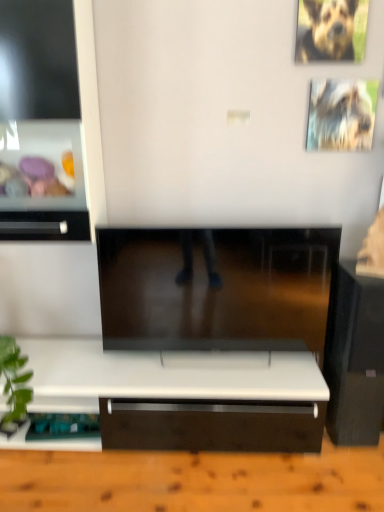
Describe the element at coordinates (354, 357) in the screenshot. The image size is (384, 512). I see `black glossy speaker at right` at that location.

This screenshot has height=512, width=384. I want to click on metallic silver picture frame at upper right, so click(341, 115).

What do you see at coordinates (328, 31) in the screenshot? I see `brown fur dog at upper right` at bounding box center [328, 31].

I want to click on white glossy drawer at left, so click(x=44, y=225).

From the image's perspective, between black glossy speaker at right and brown fur dog at upper right, which one is located above?

brown fur dog at upper right is shown above in the image.

Which object is positioned more to the right, black glossy speaker at right or brown fur dog at upper right?

black glossy speaker at right.

Which point is more forward, [368,305] or [344,12]?

Point [368,305]

Can you confirm if black glossy speaker at right is taller than brown fur dog at upper right?

Correct, black glossy speaker at right is much taller as brown fur dog at upper right.

Is metallic silver picture frame at upper right aimed at brown fur dog at upper right?

No, metallic silver picture frame at upper right is not aimed at brown fur dog at upper right.

The height and width of the screenshot is (512, 384). Identify the location of picture frame on the right of brown fur dog at upper right. (341, 115).

From a real-world perspective, is metallic silver picture frame at upper right on top of brown fur dog at upper right?

Incorrect, from a real-world perspective, metallic silver picture frame at upper right is lower than brown fur dog at upper right.

Looking at their sizes, would you say metallic silver picture frame at upper right is wider or thinner than brown fur dog at upper right?

Clearly, metallic silver picture frame at upper right has less width compared to brown fur dog at upper right.

Does brown fur dog at upper right lie behind metallic silver picture frame at upper right?

No, it is not.

Which is more to the right, brown fur dog at upper right or metallic silver picture frame at upper right?

metallic silver picture frame at upper right.

Looking at the image, does brown fur dog at upper right seem bigger or smaller compared to metallic silver picture frame at upper right?

Considering their sizes, brown fur dog at upper right takes up more space than metallic silver picture frame at upper right.

How different are the orientations of metallic silver picture frame at upper right and black glossy speaker at right in degrees?

The facing directions of metallic silver picture frame at upper right and black glossy speaker at right are 0.479 degrees apart.

Does point (333, 126) appear closer or farther from the camera than point (347, 288)?

Point (333, 126) appears to be farther away from the viewer than point (347, 288).

Which is in front, metallic silver picture frame at upper right or black glossy speaker at right?

black glossy speaker at right is more forward.

Between metallic silver picture frame at upper right and black glossy speaker at right, which one has smaller width?

metallic silver picture frame at upper right is thinner.

Is black glossy speaker at right to the left of white glossy drawer at left from the viewer's perspective?

In fact, black glossy speaker at right is to the right of white glossy drawer at left.

The width and height of the screenshot is (384, 512). I want to click on drawer on the left of the black glossy speaker at right, so click(x=44, y=225).

What's the angular difference between black glossy speaker at right and white glossy drawer at left's facing directions?

The facing directions of black glossy speaker at right and white glossy drawer at left are 0.281 degrees apart.

Which of these two, metallic silver picture frame at upper right or white glossy drawer at left, is wider?

white glossy drawer at left.

Considering the positions of objects metallic silver picture frame at upper right and white glossy drawer at left in the image provided, who is more to the left, metallic silver picture frame at upper right or white glossy drawer at left?

white glossy drawer at left.

Is point (318, 86) positioned after point (86, 232)?

No, it is not.

From a real-world perspective, is metallic silver picture frame at upper right positioned above or below white glossy drawer at left?

metallic silver picture frame at upper right is above white glossy drawer at left.

What's the angular difference between white glossy drawer at left and black glossy speaker at right's facing directions?

white glossy drawer at left and black glossy speaker at right are facing 0.281 degrees away from each other.

Could you tell me if white glossy drawer at left is turned towards black glossy speaker at right?

No, white glossy drawer at left is not oriented towards black glossy speaker at right.

At what (x,y) coordinates should I click in order to perform the action: click on drawer above the black glossy speaker at right (from a real-world perspective). Please return your answer as a coordinate pair (x, y). This screenshot has width=384, height=512. Looking at the image, I should click on (44, 225).

From a real-world perspective, is white glossy drawer at left physically located above or below black glossy speaker at right?

In terms of real-world spatial position, white glossy drawer at left is above black glossy speaker at right.

At what (x,y) coordinates should I click in order to perform the action: click on animal that appears on the left of black glossy speaker at right. Please return your answer as a coordinate pair (x, y). The height and width of the screenshot is (512, 384). Looking at the image, I should click on (328, 31).

Where is `animal above the metallic silver picture frame at upper right (from a real-world perspective)`? animal above the metallic silver picture frame at upper right (from a real-world perspective) is located at coordinates (328, 31).

Estimate the real-world distances between objects in this image. Which object is closer to white glossy drawer at left, black glossy speaker at right or brown fur dog at upper right?

black glossy speaker at right is positioned closer to the anchor white glossy drawer at left.

When comparing their distances from black glossy speaker at right, does white glossy drawer at left or brown fur dog at upper right seem closer?

brown fur dog at upper right is positioned closer to the anchor black glossy speaker at right.

When comparing their distances from black glossy speaker at right, does metallic silver picture frame at upper right or white glossy drawer at left seem further?

white glossy drawer at left.

Which object lies further to the anchor point white glossy drawer at left, brown fur dog at upper right or black glossy speaker at right?

Among the two, brown fur dog at upper right is located further to white glossy drawer at left.

From the image, which object appears to be farther from black glossy speaker at right, brown fur dog at upper right or metallic silver picture frame at upper right?

The object further to black glossy speaker at right is brown fur dog at upper right.

Which object lies further to the anchor point brown fur dog at upper right, white glossy drawer at left or black glossy speaker at right?

white glossy drawer at left is positioned further to the anchor brown fur dog at upper right.

Looking at the image, which one is located closer to brown fur dog at upper right, metallic silver picture frame at upper right or white glossy drawer at left?

Based on the image, metallic silver picture frame at upper right appears to be nearer to brown fur dog at upper right.

Looking at the image, which one is located closer to black glossy speaker at right, white glossy drawer at left or metallic silver picture frame at upper right?

metallic silver picture frame at upper right lies closer to black glossy speaker at right than the other object.

Locate an element on the screen. animal situated between white glossy drawer at left and metallic silver picture frame at upper right from left to right is located at coordinates (328, 31).

Identify the location of picture frame between white glossy drawer at left and black glossy speaker at right in the horizontal direction. This screenshot has width=384, height=512. (341, 115).

Where is `animal between white glossy drawer at left and black glossy speaker at right in the horizontal direction`? The image size is (384, 512). animal between white glossy drawer at left and black glossy speaker at right in the horizontal direction is located at coordinates (328, 31).

Identify the location of picture frame between brown fur dog at upper right and black glossy speaker at right vertically. This screenshot has width=384, height=512. (341, 115).